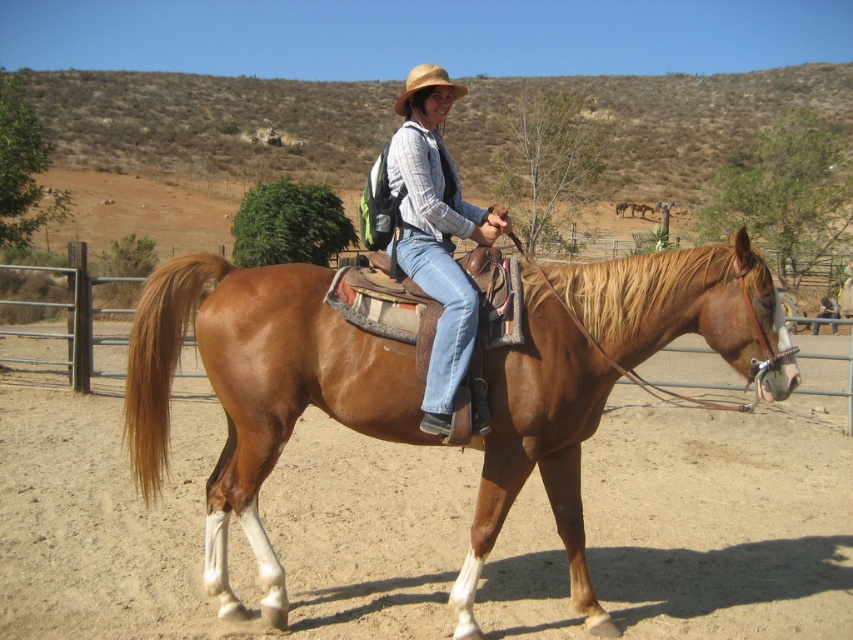
Is brown leather saddle at center in front of matte brown leather saddle at center?

No, brown leather saddle at center is behind matte brown leather saddle at center.

Does brown leather saddle at center have a greater width compared to matte brown leather saddle at center?

Yes.

Does point (608, 333) lie behind point (460, 193)?

That is False.

The height and width of the screenshot is (640, 853). I want to click on brown leather saddle at center, so tap(257, 390).

Between point (418, 218) and point (426, 67), which one is positioned in front?

Point (418, 218)

Is point (445, 177) closer to viewer compared to point (402, 109)?

Yes, point (445, 177) is closer to viewer.

Identify the location of matte brown leather saddle at center. The image size is (853, 640). (436, 232).

Who is positioned more to the right, brown leather saddle at center or straw hat at upper center?

brown leather saddle at center

From the picture: Who is more distant from viewer, (704, 272) or (463, 86)?

The point (463, 86) is behind.

At what (x,y) coordinates should I click in order to perform the action: click on brown leather saddle at center. Please return your answer as a coordinate pair (x, y). The height and width of the screenshot is (640, 853). Looking at the image, I should click on (257, 390).